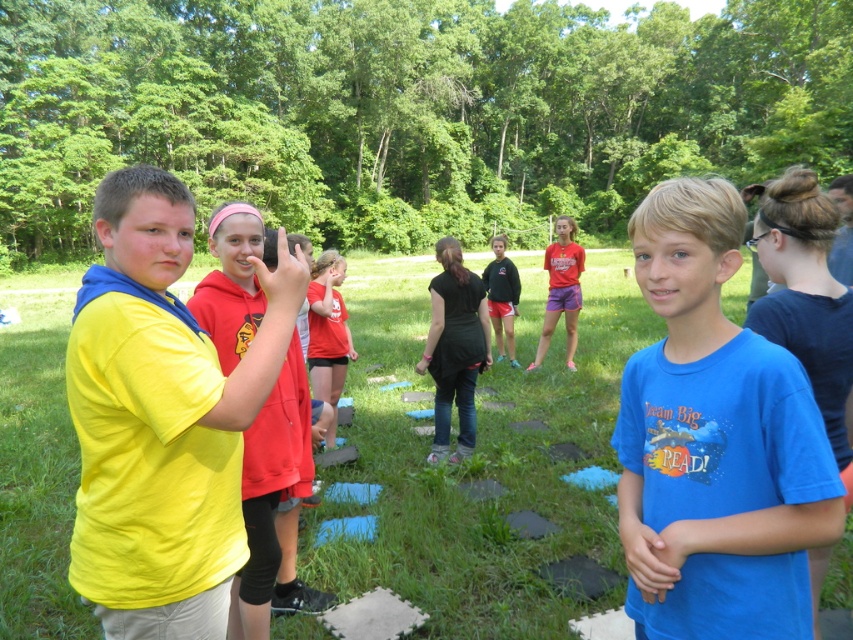
Question: Does green grass at center appear on the left side of yellow matte shirt at left?

Choices:
 (A) no
 (B) yes

Answer: (B)

Question: Can you confirm if blue cotton shirt at center is positioned to the left of yellow matte shirt at left?

Choices:
 (A) yes
 (B) no

Answer: (B)

Question: Which object is closer to the camera taking this photo?

Choices:
 (A) matte red shorts at center
 (B) yellow matte shirt at left
 (C) black hoodie at center
 (D) blue cotton shirt at center

Answer: (D)

Question: Which point is closer to the camera?

Choices:
 (A) (320, 288)
 (B) (488, 337)

Answer: (A)

Question: Which object is closer to the camera taking this photo?

Choices:
 (A) matte red shorts at center
 (B) black hoodie at center

Answer: (B)

Question: Considering the relative positions of matte red shorts at center and black hoodie at center in the image provided, where is matte red shorts at center located with respect to black hoodie at center?

Choices:
 (A) right
 (B) left

Answer: (A)